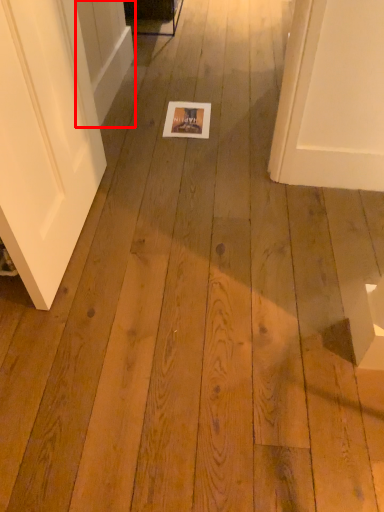
Question: From the image's perspective, what is the correct spatial relationship of screen door (annotated by the red box) in relation to postcard?

Choices:
 (A) above
 (B) below

Answer: (A)